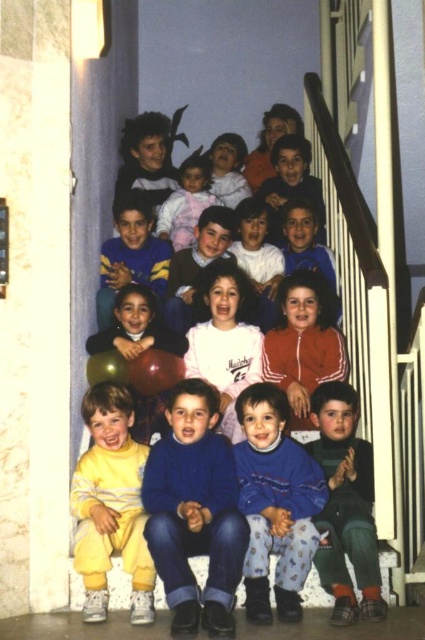
You are a photographer trying to adjust the children for a better photo. You notice the matte red jacket at center and the blue fleece sweater at center. Which child should you ask to move up a step so that their clothing items are at the same level?

You should ask the child wearing the blue fleece sweater at center to move down a step because the matte red jacket at center is currently below it, so moving the blue fleece sweater down would align them at the same level.

You are a photographer standing at the bottom of the staircase. You want to take a photo of the matte red jacket at center and the blue fleece sweater at center. Can you fit both subjects into your camera frame if your camera has a maximum width of 1.2 meters?

The distance between the matte red jacket at center and blue fleece sweater at center is 1.13 meters, which is less than the camera frame width of 1.2 meters. Yes, both subjects can be captured in the frame.